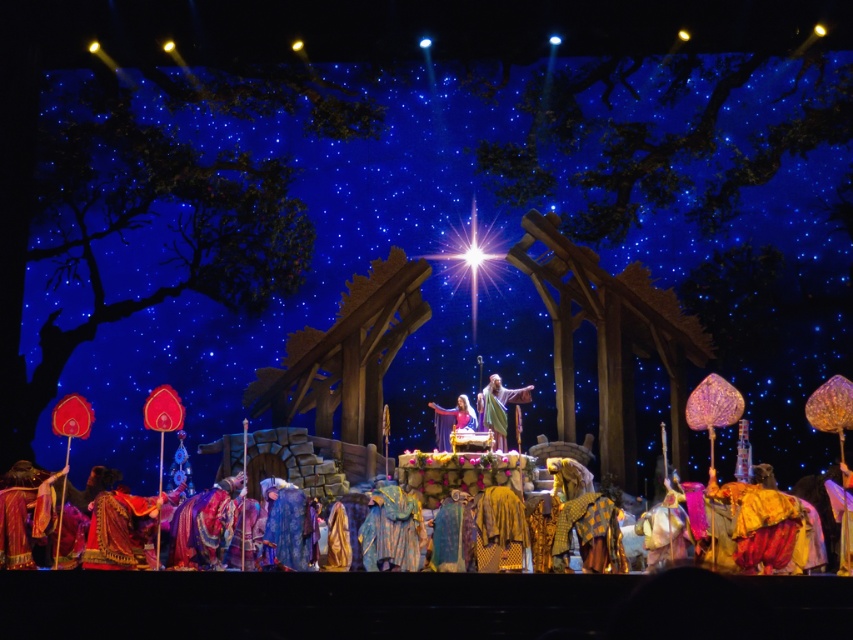
This screenshot has width=853, height=640. What do you see at coordinates (584, 520) in the screenshot?
I see `golden-yellow fabric at center` at bounding box center [584, 520].

Is golden-yellow fabric at center wider than blue velvet robe at center?

Yes.

Consider the image. Who is more forward, (599, 544) or (292, 525)?

Point (599, 544) is in front.

Image resolution: width=853 pixels, height=640 pixels. Identify the location of golden-yellow fabric at center. (584, 520).

Is point (479, 515) behind point (486, 428)?

No.

Does golden textured robe at center appear on the right side of smooth beige robe at center?

No, golden textured robe at center is not to the right of smooth beige robe at center.

Find the location of `golden textured robe at center`. golden textured robe at center is located at coordinates (498, 531).

Find the location of `golden textured robe at center`. golden textured robe at center is located at coordinates (498, 531).

Can you confirm if golden-yellow fabric at center is smaller than golden textured robe at center?

Incorrect, golden-yellow fabric at center is not smaller in size than golden textured robe at center.

Is golden-yellow fabric at center positioned behind golden textured robe at center?

No, golden-yellow fabric at center is in front of golden textured robe at center.

Which is in front, point (593, 560) or point (511, 547)?

Positioned in front is point (511, 547).

Identify the location of golden-yellow fabric at center. This screenshot has height=640, width=853. tap(584, 520).